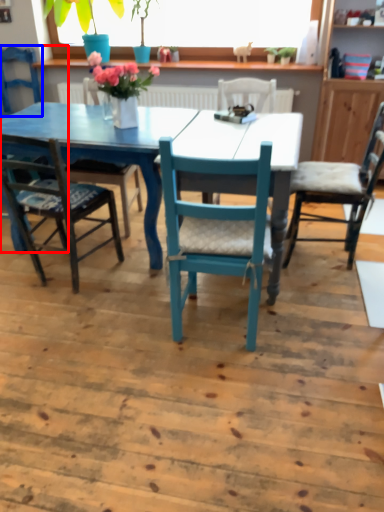
Question: Which object appears closest to the camera in this image, chair (highlighted by a red box) or chair (highlighted by a blue box)?

Choices:
 (A) chair
 (B) chair

Answer: (A)